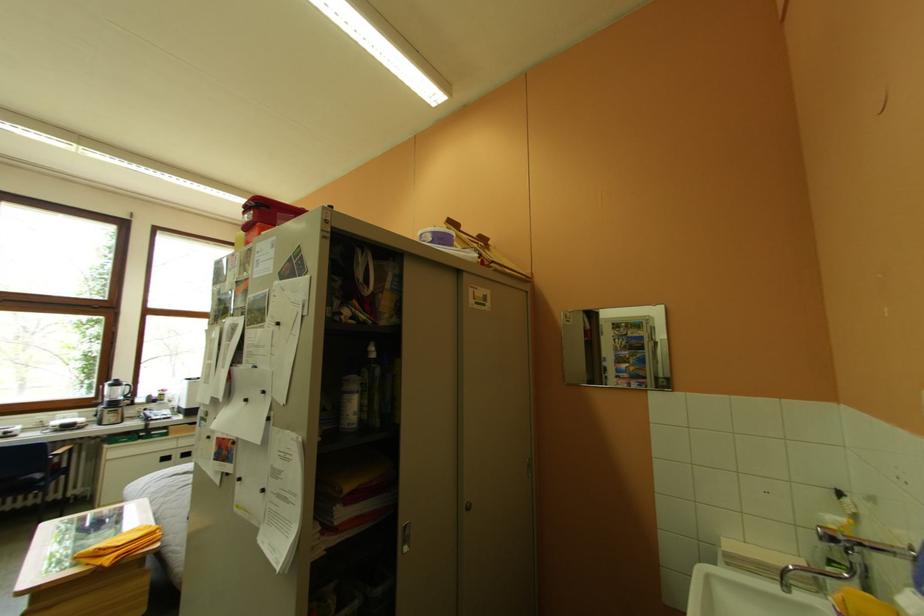
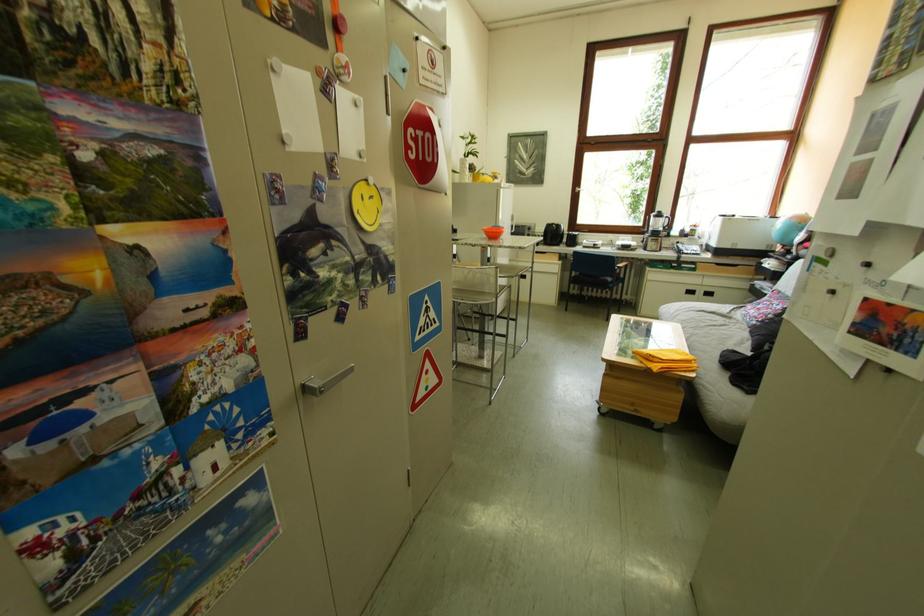
The first image is from the beginning of the video and the second image is from the end. How did the camera likely rotate when shooting the video?

The rotation direction of the camera is left-down.